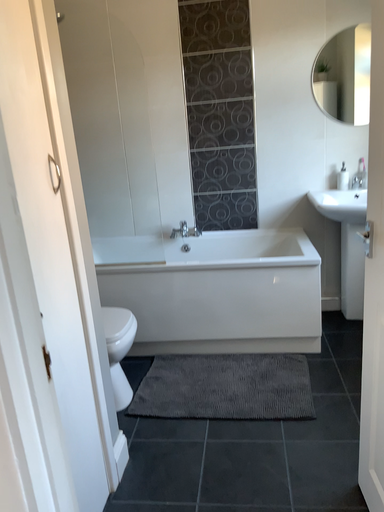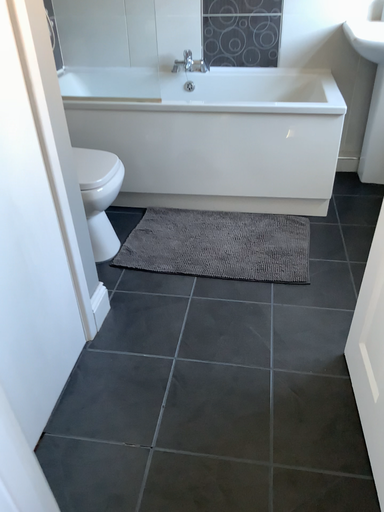
Question: Which way did the camera rotate in the video?

Choices:
 (A) rotated upward
 (B) rotated downward

Answer: (B)